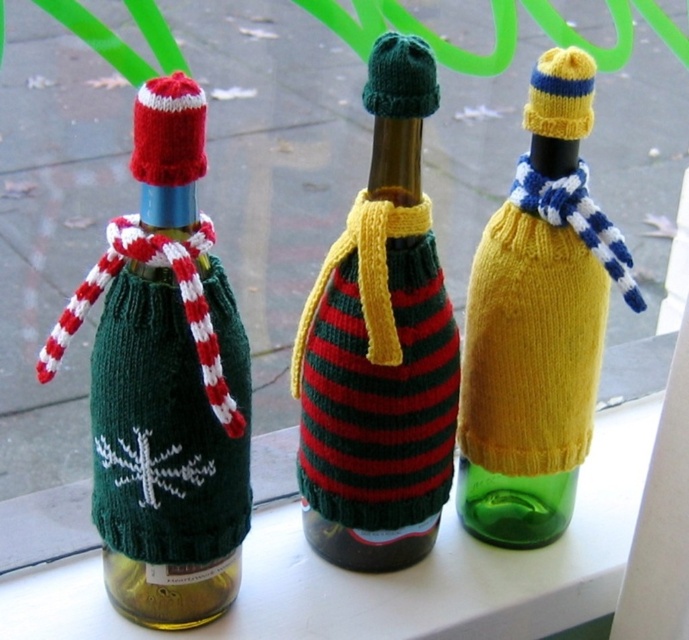
Question: Which object appears farthest from the camera in this image?

Choices:
 (A) yellow knitted sweater at center
 (B) striped knit sweater at center

Answer: (A)

Question: Does striped knit sweater at center appear on the right side of green knitted sweater at left?

Choices:
 (A) yes
 (B) no

Answer: (A)

Question: Can you confirm if green knitted sweater at left is wider than yellow knitted sweater at center?

Choices:
 (A) no
 (B) yes

Answer: (A)

Question: Observing the image, what is the correct spatial positioning of striped knit sweater at center in reference to green knitted sweater at left?

Choices:
 (A) left
 (B) right

Answer: (B)

Question: Which of the following is the closest to the observer?

Choices:
 (A) (477, 349)
 (B) (415, 552)

Answer: (A)

Question: Which is nearer to the green knitted sweater at left?

Choices:
 (A) striped knit sweater at center
 (B) yellow knitted sweater at center

Answer: (A)